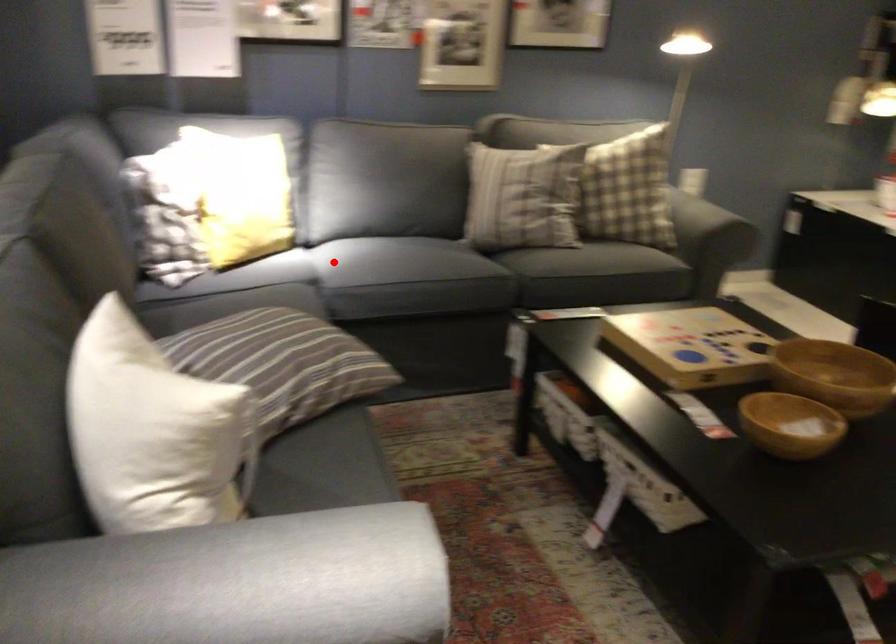
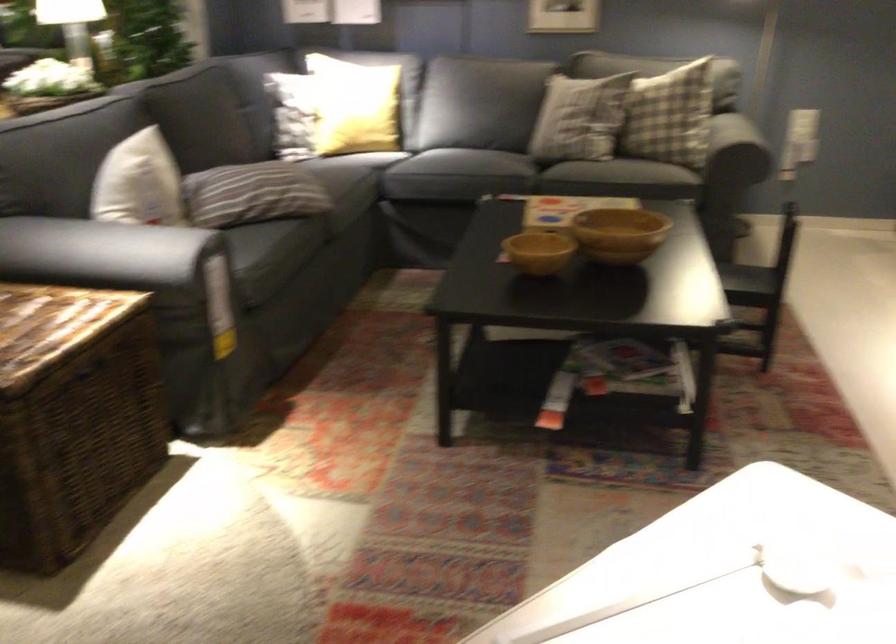
Question: I am providing you with two images of the same scene from different viewpoints. In image1, a red point is highlighted. Considering the same 3D point in image2, which of the following is correct?

Choices:
 (A) It is closer
 (B) It is farther

Answer: (B)